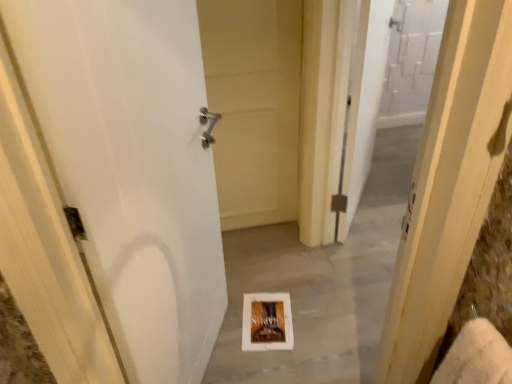
Question: Considering the relative positions of white paper at center and white matte door at center, the first door in the back-to-front sequence, in the image provided, is white paper at center behind white matte door at center, the first door in the back-to-front sequence,?

Choices:
 (A) yes
 (B) no

Answer: (B)

Question: Does white paper at center have a larger size compared to white matte door at center, the first door in the back-to-front sequence?

Choices:
 (A) yes
 (B) no

Answer: (A)

Question: Is white paper at center to the right of white matte door at center, positioned as the second door in front-to-back order, from the viewer's perspective?

Choices:
 (A) no
 (B) yes

Answer: (B)

Question: Does white paper at center have a greater width compared to white matte door at center, the first door in the back-to-front sequence?

Choices:
 (A) no
 (B) yes

Answer: (B)

Question: From a real-world perspective, is white paper at center on top of white matte door at center, positioned as the second door in front-to-back order?

Choices:
 (A) yes
 (B) no

Answer: (B)

Question: Does white paper at center have a lesser height compared to white matte door at center, positioned as the second door in front-to-back order?

Choices:
 (A) no
 (B) yes

Answer: (B)

Question: Is white cardboard book at center looking in the opposite direction of white matte door at center, positioned as the second door in front-to-back order?

Choices:
 (A) no
 (B) yes

Answer: (A)

Question: Does white cardboard book at center appear on the left side of white matte door at center, positioned as the second door in front-to-back order?

Choices:
 (A) no
 (B) yes

Answer: (A)

Question: Does white cardboard book at center turn towards white matte door at center, positioned as the second door in front-to-back order?

Choices:
 (A) no
 (B) yes

Answer: (A)

Question: Considering the relative sizes of white cardboard book at center and white matte door at center, positioned as the second door in front-to-back order, in the image provided, is white cardboard book at center smaller than white matte door at center, positioned as the second door in front-to-back order,?

Choices:
 (A) yes
 (B) no

Answer: (A)

Question: Can you confirm if white cardboard book at center is positioned to the right of white matte door at center, the first door in the back-to-front sequence?

Choices:
 (A) no
 (B) yes

Answer: (B)

Question: Is white cardboard book at center not close to white matte door at center, positioned as the second door in front-to-back order?

Choices:
 (A) yes
 (B) no

Answer: (B)

Question: Is white matte door at center, the second door from the back, wider than white cardboard book at center?

Choices:
 (A) no
 (B) yes

Answer: (A)